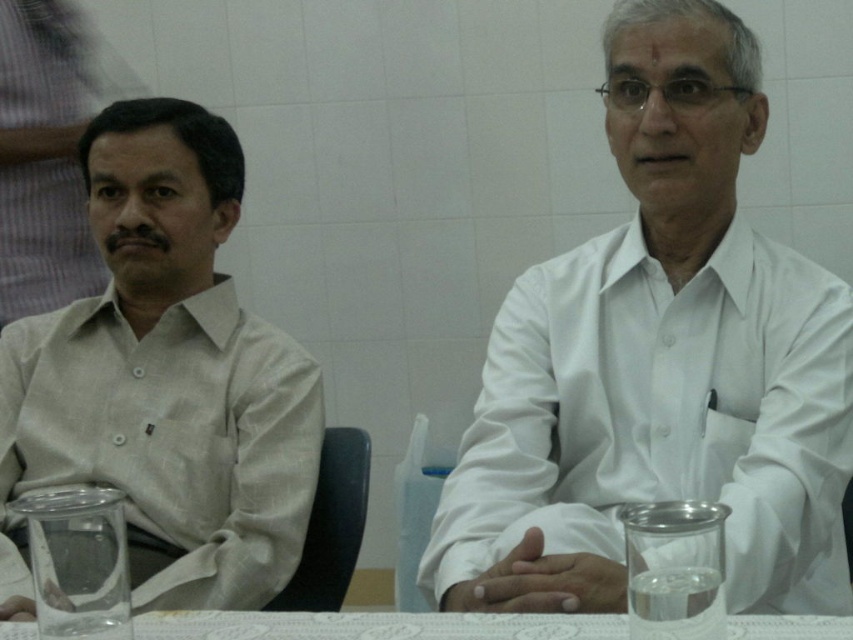
You are a photographer taking a picture of the scene. You notice the white lace tablecloth at center and the white matte shirt at center. Which object is closer to the camera?

The white matte shirt at center is closer to the camera because the white lace tablecloth at center is behind it.

Looking at this image, you are a photographer taking a picture of the scene. The light beige fabric shirt at left and the white lace tablecloth at center are both in your frame. Which object will appear larger in the photo?

The light beige fabric shirt at left will appear larger in the photo because it is much taller than the white lace tablecloth at center.